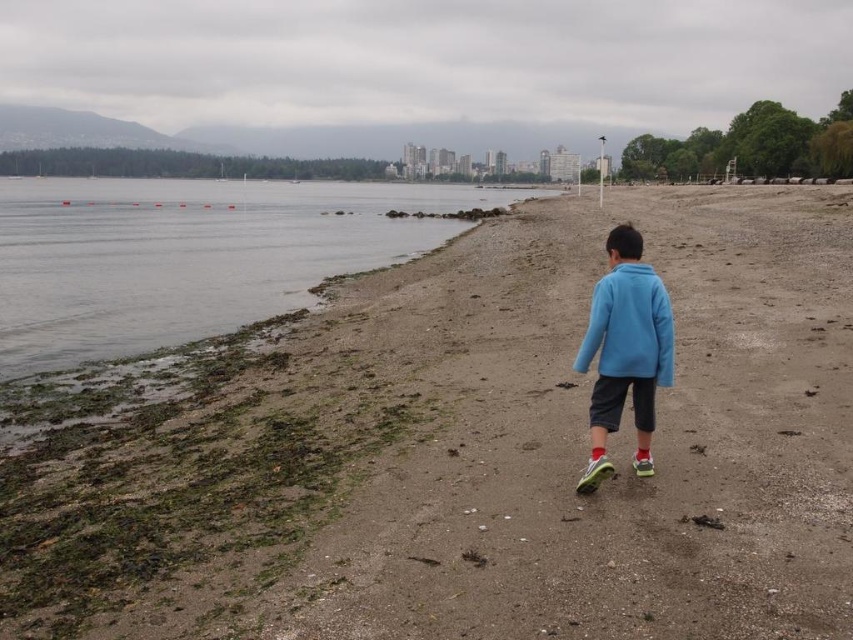
Question: Is dull sand beach at center positioned in front of blue fleece jacket at center?

Choices:
 (A) yes
 (B) no

Answer: (A)

Question: Can you confirm if dull sand beach at center is positioned below matte blue jacket at center?

Choices:
 (A) yes
 (B) no

Answer: (B)

Question: Based on their relative distances, which object is farther from the smooth sand at lower left?

Choices:
 (A) dull sand beach at center
 (B) blue fleece jacket at center
 (C) matte blue jacket at center

Answer: (B)

Question: Observing the image, what is the correct spatial positioning of dull sand beach at center in reference to matte blue jacket at center?

Choices:
 (A) right
 (B) left

Answer: (A)

Question: Estimate the real-world distances between objects in this image. Which object is farther from the smooth sand at lower left?

Choices:
 (A) dull sand beach at center
 (B) blue fleece jacket at center
 (C) matte blue jacket at center

Answer: (B)

Question: Which point is closer to the camera?

Choices:
 (A) (585, 339)
 (B) (392, 189)
 (C) (637, 314)
 (D) (274, 452)

Answer: (C)